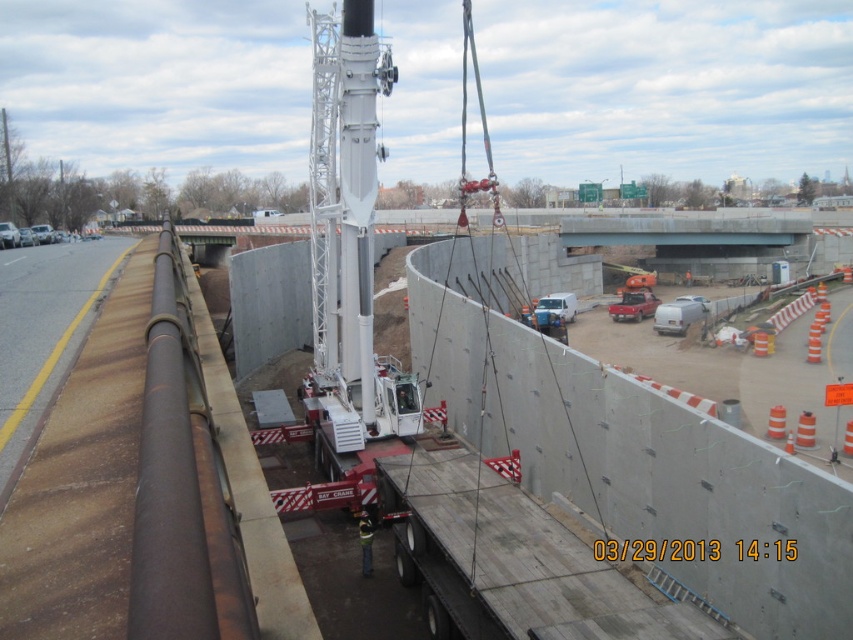
You are a construction worker who needs to place a 2m wide equipment between the concrete wall at center and the reflective yellow safety vest at center. Can you fit it there?

The concrete wall at center might be wider than reflective yellow safety vest at center, so there might be enough space to fit the 2m wide equipment between them.

You are a delivery driver who needs to unload a heavy crate from your truck onto the construction site. The crate must be placed on the brown asphalt highway at left. Given that the concrete wall at center is in the way, can the crane be used to move the crate over the wall to its destination?

The concrete wall at center is below brown asphalt highway at left, so the crane can lift the crate over the wall and place it on the brown asphalt highway at left since the wall is lower than the highway.